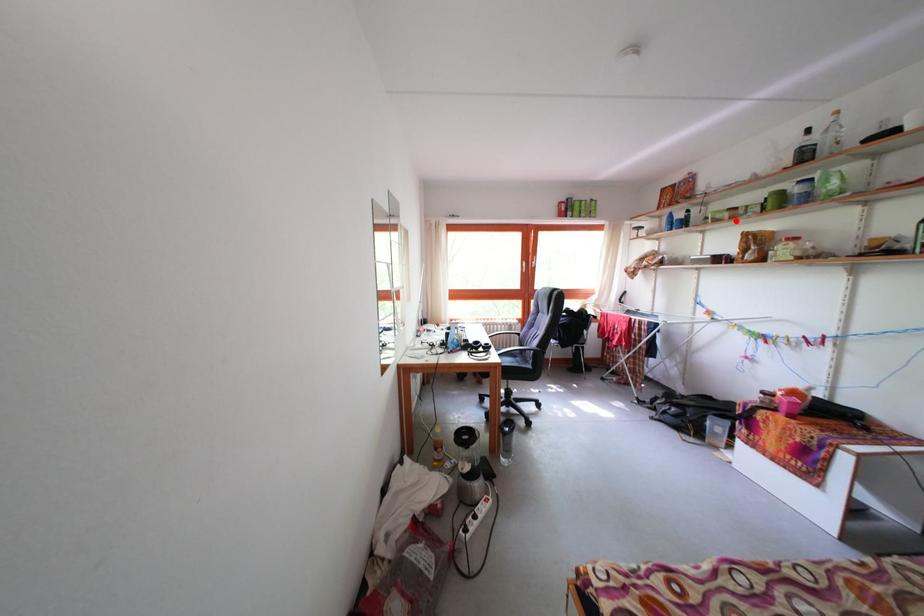
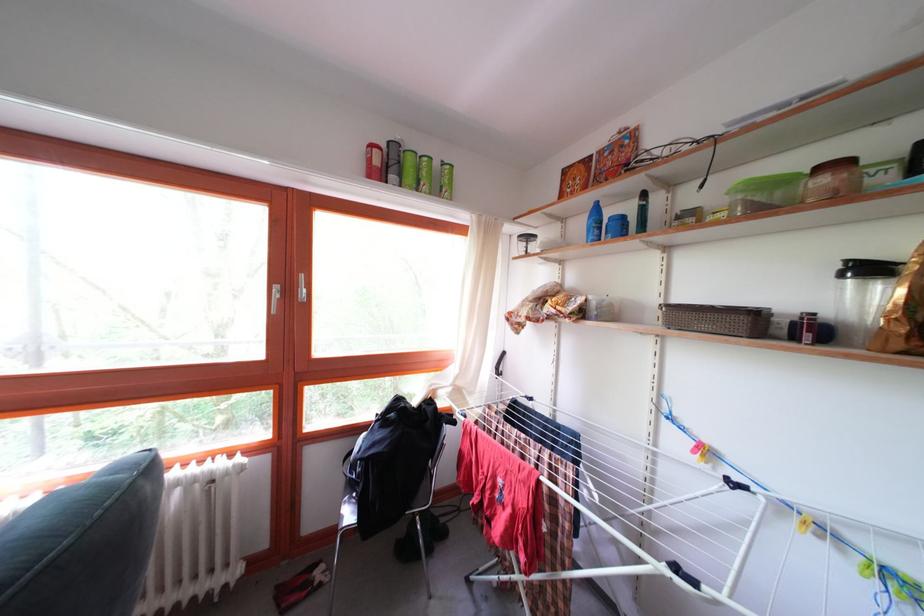
The point at the highlighted location is marked in the first image. Where is the corresponding point in the second image?

(832, 187)